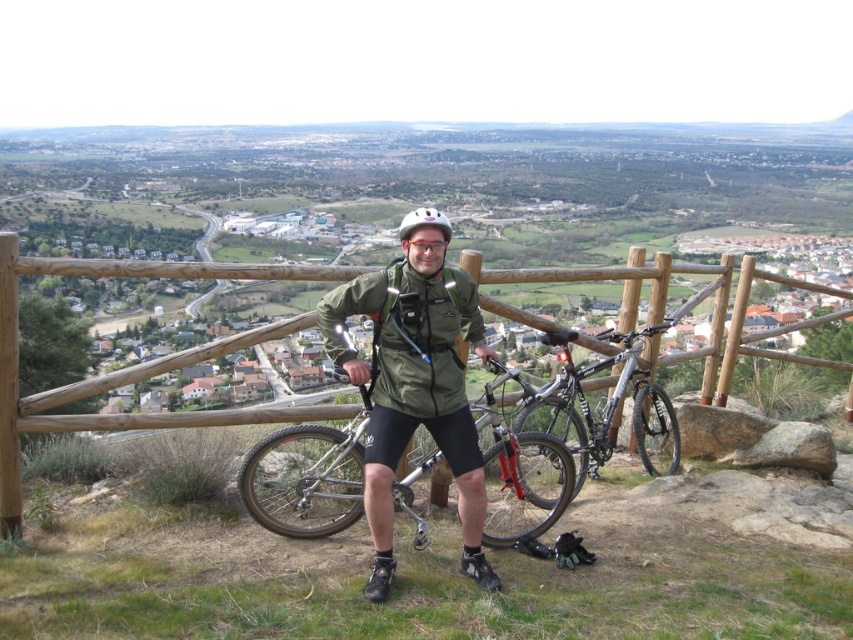
Question: Among these objects, which one is nearest to the camera?

Choices:
 (A) green matte jacket at center
 (B) wooden at center
 (C) silver metallic bicycle at center

Answer: (A)

Question: Is green matte jacket at center bigger than wooden at center?

Choices:
 (A) yes
 (B) no

Answer: (B)

Question: Is green matte jacket at center wider than wooden at center?

Choices:
 (A) yes
 (B) no

Answer: (B)

Question: Which object is the farthest from the silver metallic bicycle at center?

Choices:
 (A) silver metallic mountain bike at center
 (B) wooden at center
 (C) green matte jacket at center

Answer: (B)

Question: Which object is the farthest from the wooden at center?

Choices:
 (A) silver metallic mountain bike at center
 (B) green matte jacket at center
 (C) silver metallic bicycle at center

Answer: (B)

Question: Observing the image, what is the correct spatial positioning of green matte jacket at center in reference to wooden at center?

Choices:
 (A) right
 (B) left

Answer: (A)